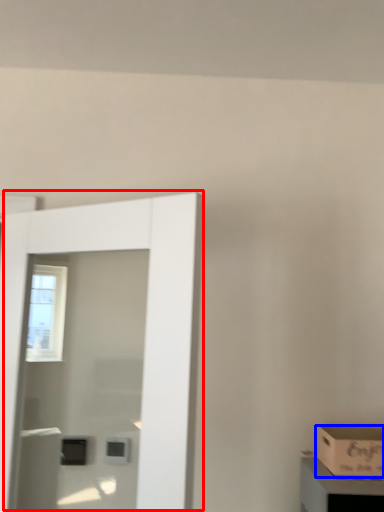
Question: Which object is closer to the camera taking this photo, door (highlighted by a red box) or box (highlighted by a blue box)?

Choices:
 (A) door
 (B) box

Answer: (A)